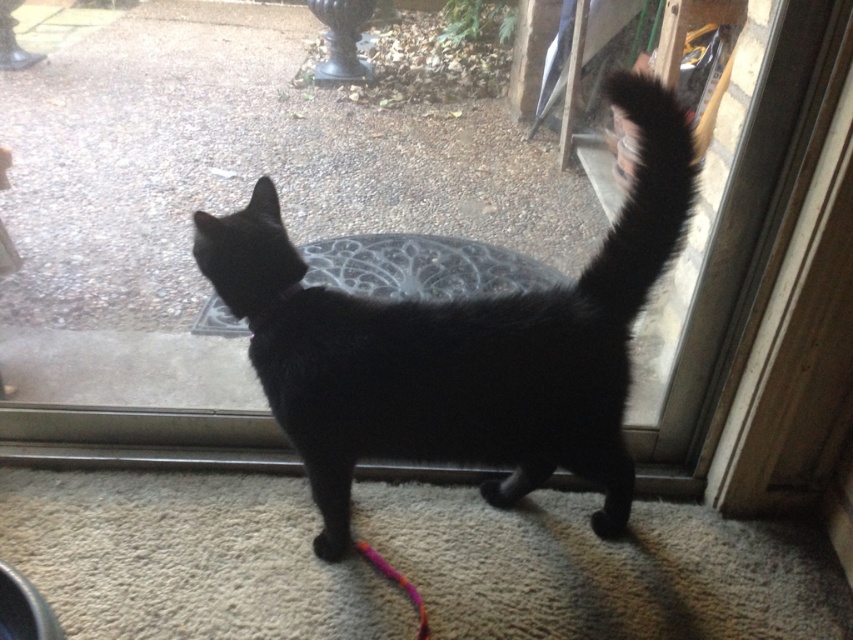
Question: Is transparent glass window at center above black fluffy tail at upper right?

Choices:
 (A) no
 (B) yes

Answer: (B)

Question: Where is transparent glass window at center located in relation to black fluffy tail at upper right in the image?

Choices:
 (A) below
 (B) above

Answer: (B)

Question: Which point is farther to the camera?

Choices:
 (A) black fur cat at center
 (B) black fluffy tail at upper right

Answer: (A)

Question: Based on their relative distances, which object is farther from the transparent glass window at center?

Choices:
 (A) black fluffy tail at upper right
 (B) black fur cat at center

Answer: (A)

Question: Which point is farther to the camera?

Choices:
 (A) (654, 244)
 (B) (657, 102)

Answer: (A)

Question: Is transparent glass window at center in front of black fluffy tail at upper right?

Choices:
 (A) yes
 (B) no

Answer: (B)